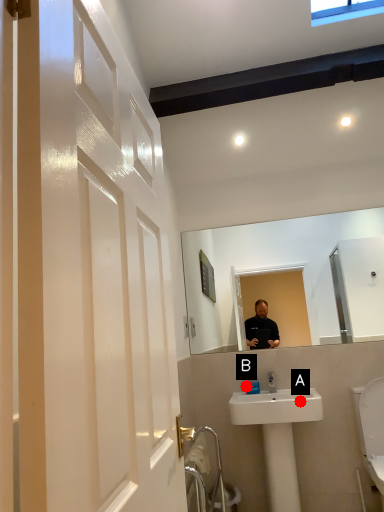
Question: Two points are circled on the image, labeled by A and B beside each circle. Among these points, which one is farthest from the camera?

Choices:
 (A) A is further
 (B) B is further

Answer: (B)